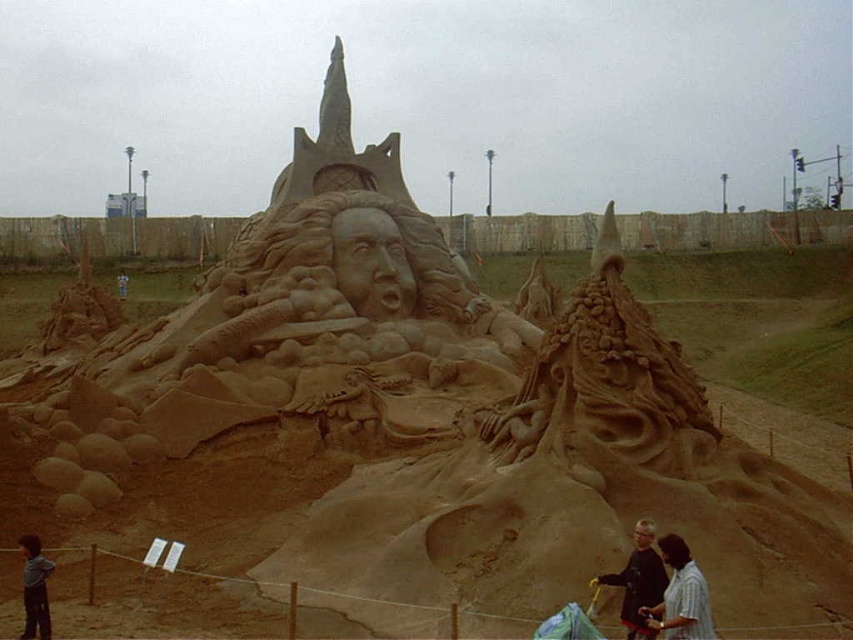
You are a photographer at the sand sculpture event. You want to capture a photo that includes both the striped shirt at lower right and the blue fabric at center. Which object should you position closer to the camera to ensure both are in focus?

To ensure both the striped shirt at lower right and the blue fabric at center are in focus, position the striped shirt at lower right closer to the camera since it is shorter than the blue fabric at center. This way, the distance between the two objects will be minimized, allowing for a greater depth of field.

You are standing 50 meters away from the sand sculpture. A point labeled as point (685, 566) is part of the sculpture. Is this point closer to you or farther than your current position?

The distance of point (685, 566) from viewer is 52.70 meters, so the point is farther away than your current position of 50 meters.